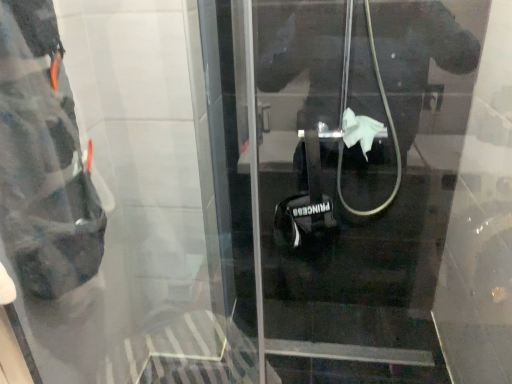
Question: From the image's perspective, is transparent plastic door at center beneath black matte bag at left?

Choices:
 (A) no
 (B) yes

Answer: (B)

Question: From a real-world perspective, is transparent plastic door at center located higher than black matte bag at left?

Choices:
 (A) yes
 (B) no

Answer: (B)

Question: Is black matte bag at left surrounded by transparent plastic door at center?

Choices:
 (A) no
 (B) yes

Answer: (A)

Question: Is transparent plastic door at center to the left of black matte bag at left from the viewer's perspective?

Choices:
 (A) no
 (B) yes

Answer: (A)

Question: Can you confirm if transparent plastic door at center is shorter than black matte bag at left?

Choices:
 (A) no
 (B) yes

Answer: (A)

Question: Is transparent plastic door at center wider than black matte bag at left?

Choices:
 (A) yes
 (B) no

Answer: (B)

Question: Is black matte bag at left outside of transparent plastic door at center?

Choices:
 (A) no
 (B) yes

Answer: (B)

Question: Does black matte bag at left lie behind transparent plastic door at center?

Choices:
 (A) yes
 (B) no

Answer: (A)

Question: Are black matte bag at left and transparent plastic door at center beside each other?

Choices:
 (A) no
 (B) yes

Answer: (A)

Question: Can you confirm if black matte bag at left is bigger than transparent plastic door at center?

Choices:
 (A) no
 (B) yes

Answer: (A)

Question: From a real-world perspective, is black matte bag at left physically below transparent plastic door at center?

Choices:
 (A) yes
 (B) no

Answer: (B)

Question: From the image's perspective, is black matte bag at left located beneath transparent plastic door at center?

Choices:
 (A) yes
 (B) no

Answer: (B)

Question: Is point (16, 125) positioned closer to the camera than point (269, 246)?

Choices:
 (A) farther
 (B) closer

Answer: (B)